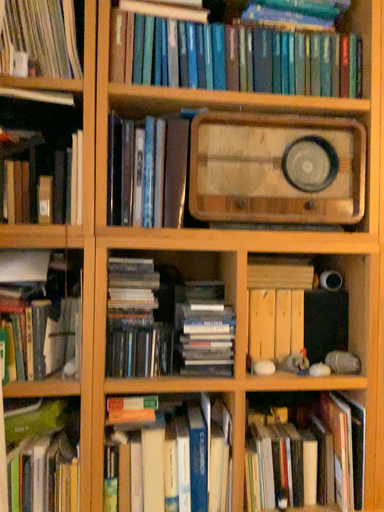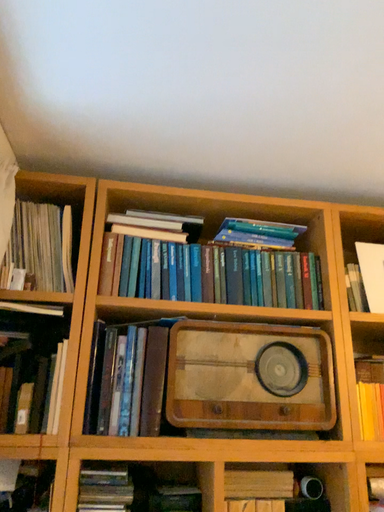
Question: Which way did the camera rotate in the video?

Choices:
 (A) rotated downward
 (B) rotated upward

Answer: (B)